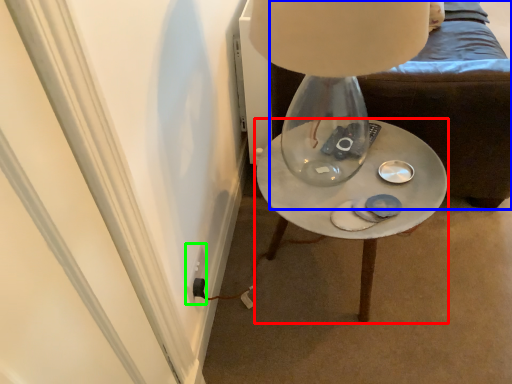
Question: Based on their relative distances, which object is nearer to table (highlighted by a red box)? Choose from furniture (highlighted by a blue box) and electric outlet (highlighted by a green box).

Choices:
 (A) furniture
 (B) electric outlet

Answer: (A)